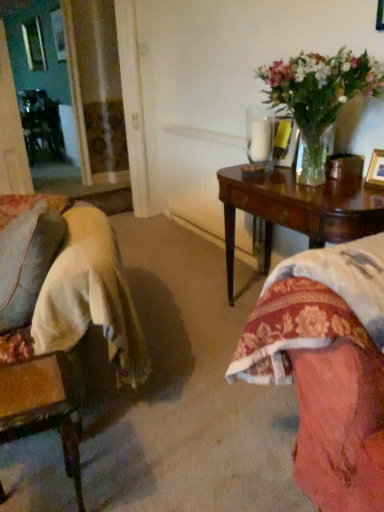
Locate an element on the screen. The image size is (384, 512). free point above wooden swivel chair at lower left (from a real-world perspective) is located at coordinates (32, 381).